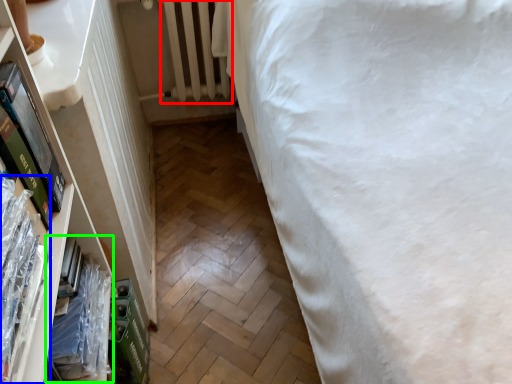
Question: Based on their relative distances, which object is nearer to radiator (highlighted by a red box)? Choose from book (highlighted by a blue box) and book (highlighted by a green box).

Choices:
 (A) book
 (B) book

Answer: (B)